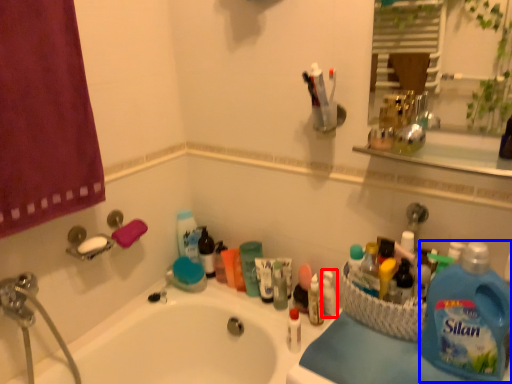
Question: Which object is closer to the camera taking this photo, toiletry (highlighted by a red box) or cleaning product (highlighted by a blue box)?

Choices:
 (A) toiletry
 (B) cleaning product

Answer: (B)